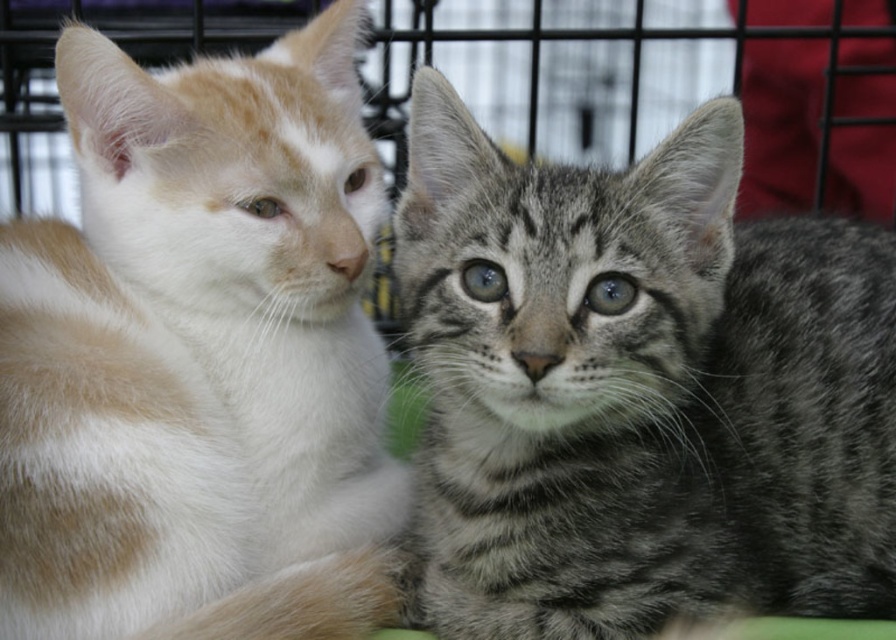
Based on the photo, between gray striped kitten at center and white fur cat at left, which one is positioned lower?

Positioned lower is gray striped kitten at center.

Between gray striped kitten at center and white fur cat at left, which one appears on the left side from the viewer's perspective?

From the viewer's perspective, white fur cat at left appears more on the left side.

Describe the element at coordinates (639, 388) in the screenshot. I see `gray striped kitten at center` at that location.

Locate an element on the screen. Image resolution: width=896 pixels, height=640 pixels. gray striped kitten at center is located at coordinates (639, 388).